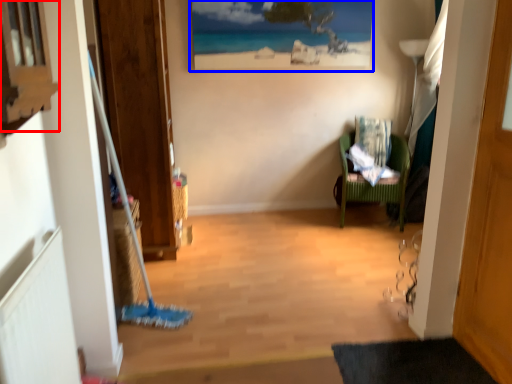
Question: Which of the following is the farthest to the observer, window (highlighted by a red box) or picture frame (highlighted by a blue box)?

Choices:
 (A) window
 (B) picture frame

Answer: (B)